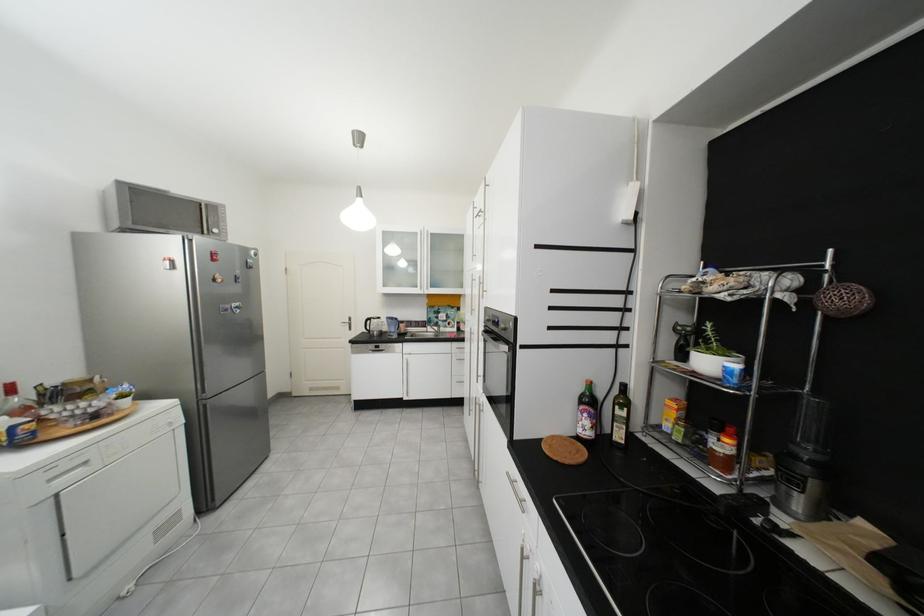
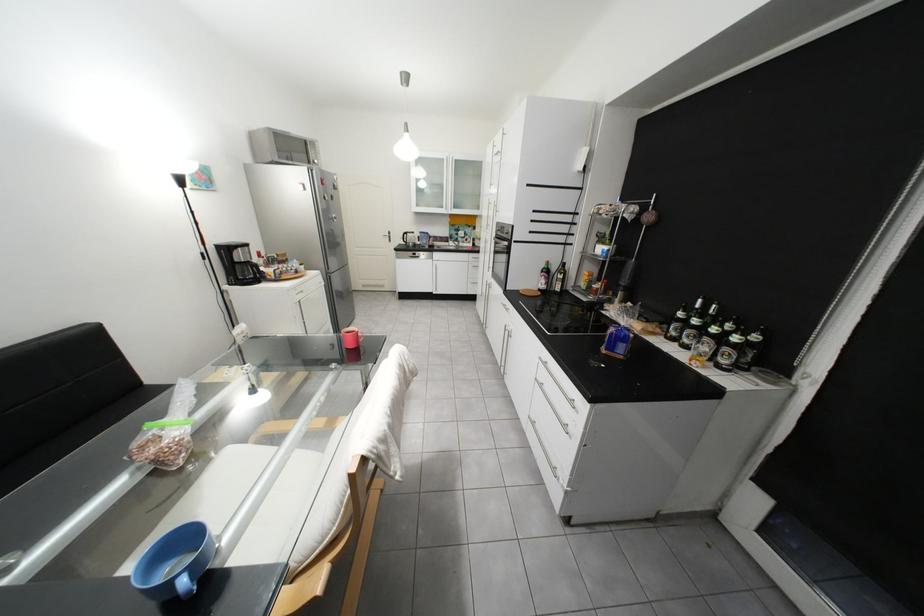
Find the pixel in the second image that matches pixel 689 439 in the first image.

(596, 288)